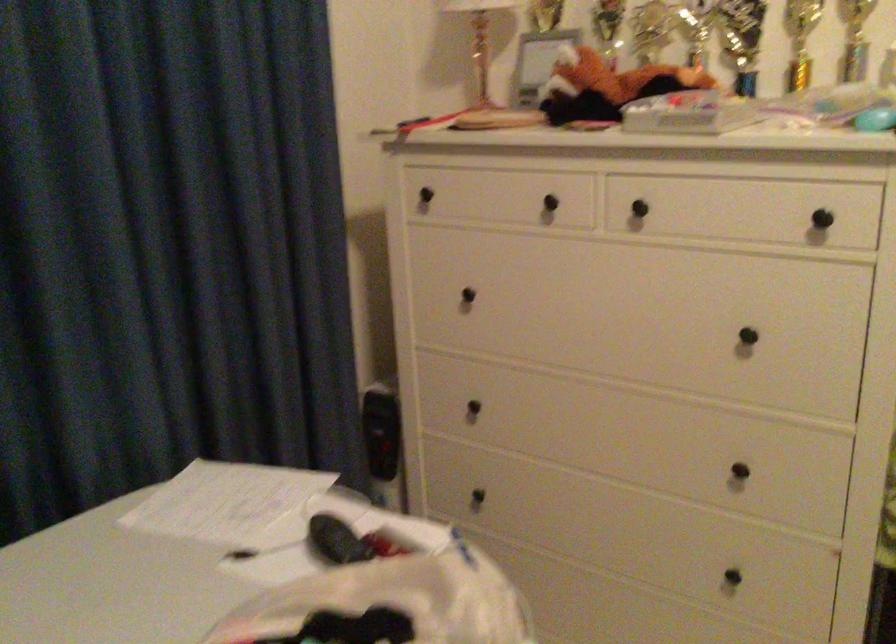
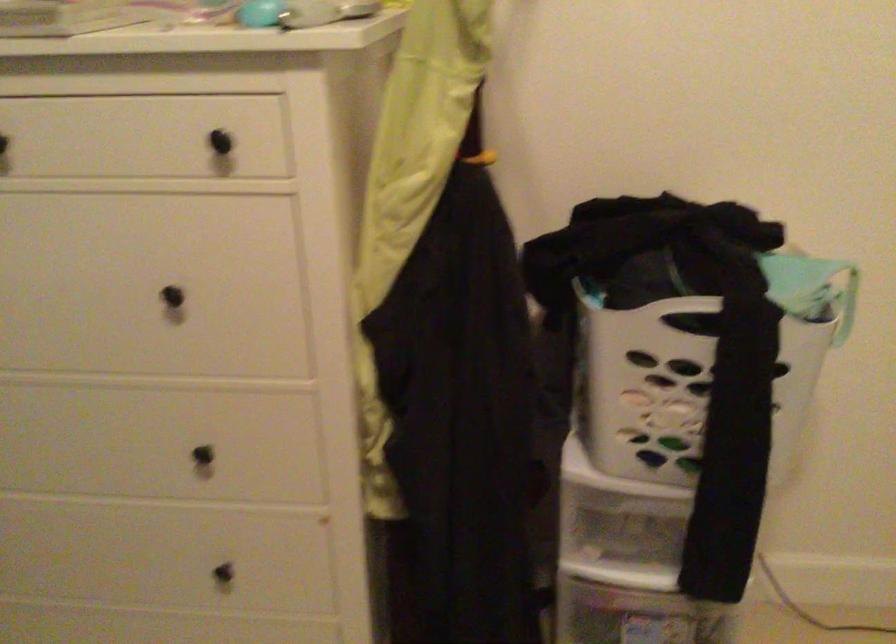
The point at (745, 483) is marked in the first image. Where is the corresponding point in the second image?

(213, 462)